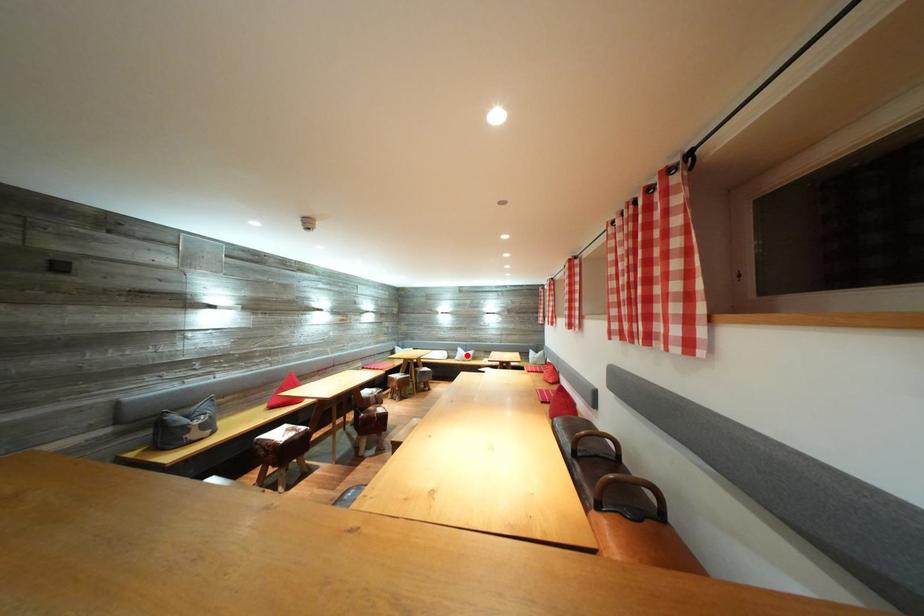
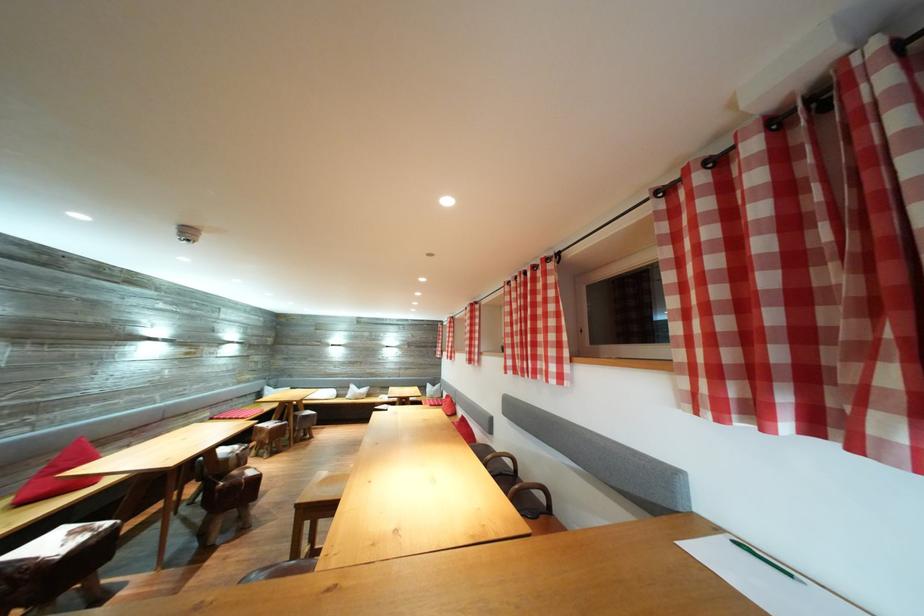
The point at the highlighted location is marked in the first image. Where is the corresponding point in the second image?

(359, 392)